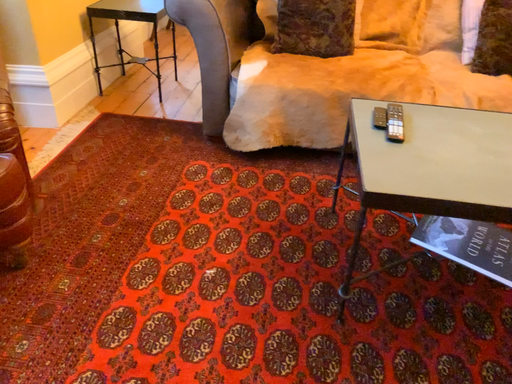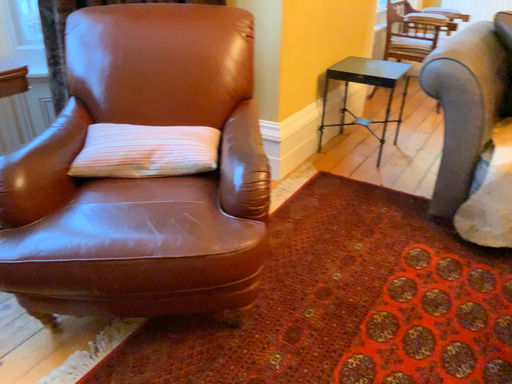
Question: How did the camera likely rotate when shooting the video?

Choices:
 (A) rotated left
 (B) rotated right

Answer: (A)